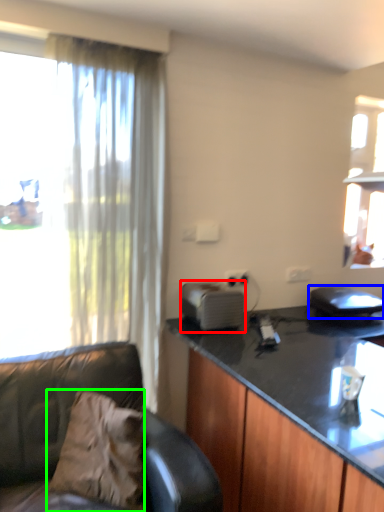
Question: Considering the real-world distances, which object is farthest from appliance (highlighted by a red box)? appliance (highlighted by a blue box) or pillow (highlighted by a green box)?

Choices:
 (A) appliance
 (B) pillow

Answer: (A)